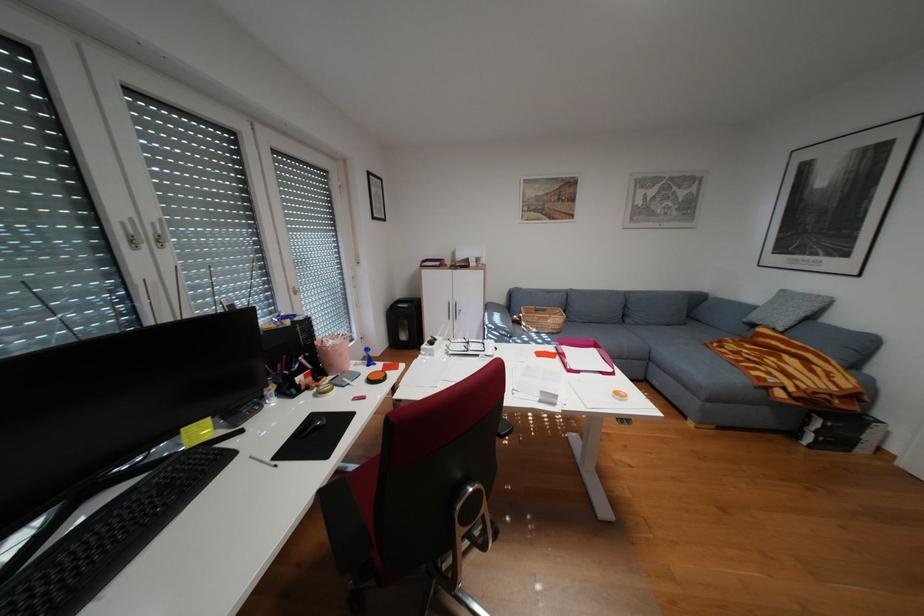
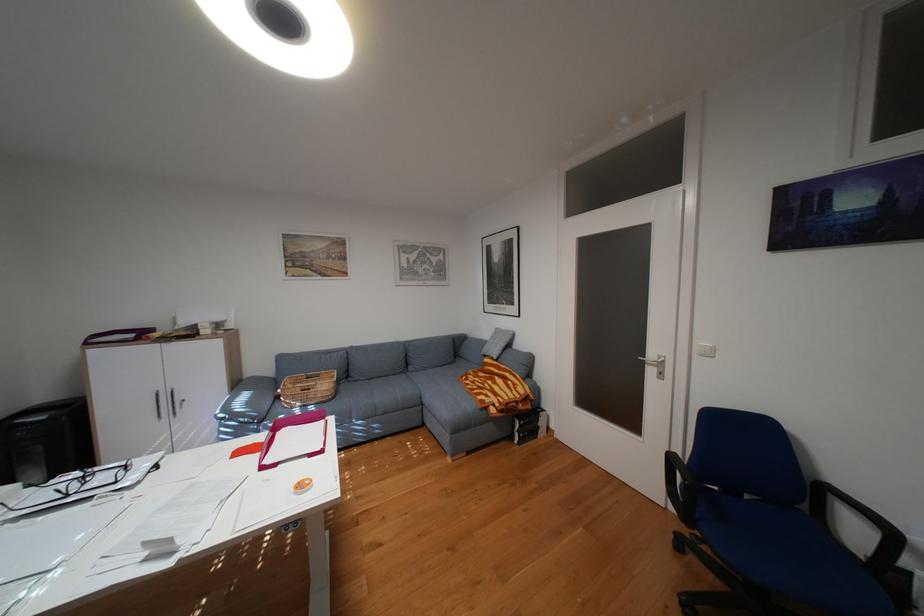
Find the pixel in the second image that matches point (811, 438) in the first image.

(526, 438)